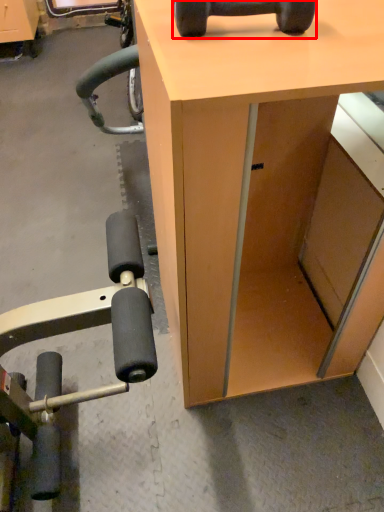
Question: From the image, what is the correct spatial relationship of dumbbell (annotated by the red box) in relation to desk?

Choices:
 (A) left
 (B) right

Answer: (A)